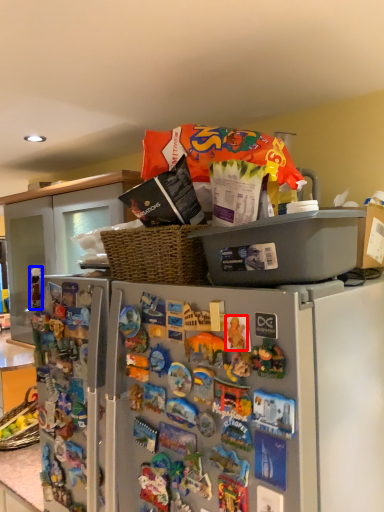
Question: Which object is closer to the camera taking this photo, toy (highlighted by a red box) or toy (highlighted by a blue box)?

Choices:
 (A) toy
 (B) toy

Answer: (A)